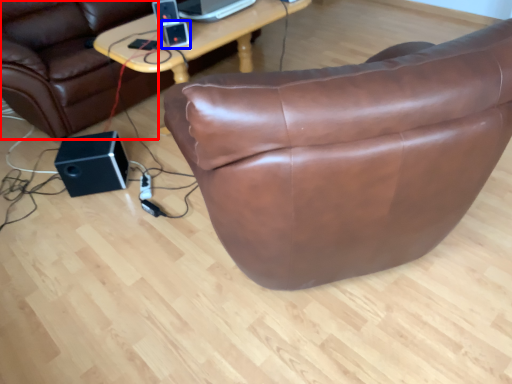
Question: Which of the following is the closest to the observer, bean bag chair (highlighted by a red box) or ipod (highlighted by a blue box)?

Choices:
 (A) bean bag chair
 (B) ipod

Answer: (A)